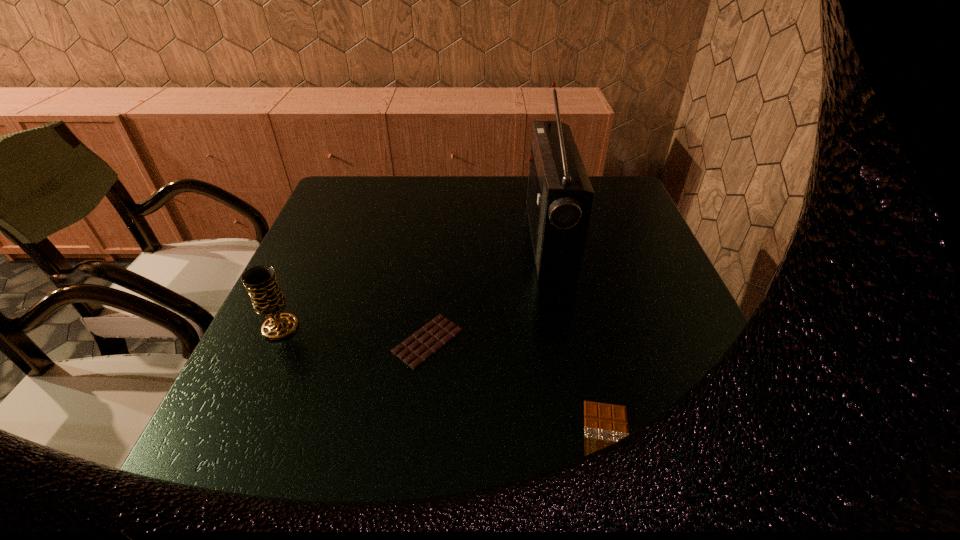
Locate an element on the screen. This screenshot has height=540, width=960. vacant space located on the front-facing side of the farthest object is located at coordinates (492, 240).

Where is `vacant region located on the front of the third shortest object`? The image size is (960, 540). vacant region located on the front of the third shortest object is located at coordinates (249, 395).

Image resolution: width=960 pixels, height=540 pixels. What are the coordinates of `free space located 0.390m on the back of the taller chocolate bar` in the screenshot? It's located at (443, 217).

Where is `vacant space positioned 0.200m on the right of the shorter chocolate bar`? This screenshot has width=960, height=540. vacant space positioned 0.200m on the right of the shorter chocolate bar is located at coordinates (757, 449).

Locate an element on the screen. object situated at the far edge is located at coordinates (559, 197).

Where is `object situated at the near edge`? This screenshot has width=960, height=540. object situated at the near edge is located at coordinates (604, 424).

The height and width of the screenshot is (540, 960). I want to click on object at the left edge, so click(x=268, y=300).

You are a GUI agent. You are given a task and a screenshot of the screen. Output one action in this format:
    pyautogui.click(x=<x>, y=<y>)
    Task: Click on the vacant space at the far edge of the desktop
    This screenshot has width=960, height=540.
    Given the screenshot: What is the action you would take?
    pyautogui.click(x=456, y=177)

Find the location of `free location at the near edge of the desktop`. free location at the near edge of the desktop is located at coordinates (599, 457).

You are a GUI agent. You are given a task and a screenshot of the screen. Output one action in this format:
    pyautogui.click(x=<x>, y=<y>)
    Task: Click on the free location at the left edge
    This screenshot has height=540, width=960.
    Given the screenshot: What is the action you would take?
    pyautogui.click(x=302, y=353)